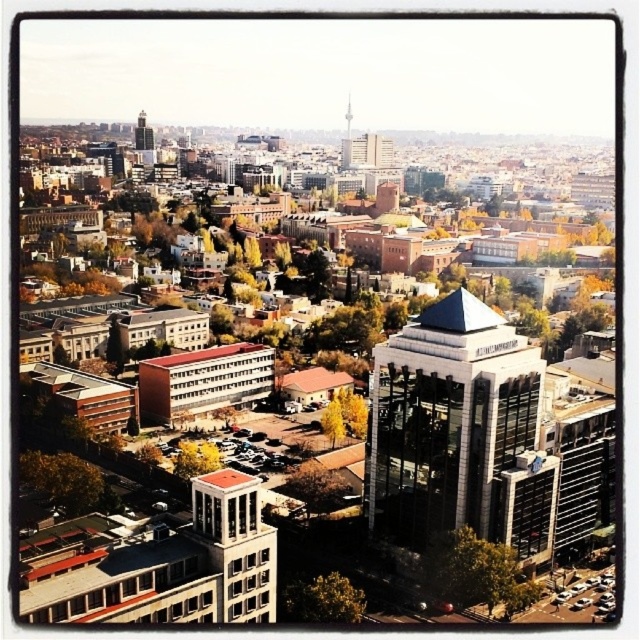
Question: Can you confirm if glassy silver tower at center is bigger than green leafy tree at center?

Choices:
 (A) no
 (B) yes

Answer: (B)

Question: Among these objects, which one is farthest from the camera?

Choices:
 (A) yellow-green leaves at center
 (B) green leafy tree at center

Answer: (A)

Question: Based on their relative distances, which object is farther from the glassy silver tower at center?

Choices:
 (A) green leafy tree at lower right
 (B) green leafy tree at lower center

Answer: (B)

Question: Does green leafy tree at lower right appear under green leafy tree at lower center?

Choices:
 (A) no
 (B) yes

Answer: (B)

Question: Does glassy silver tower at center lie behind green leafy tree at center?

Choices:
 (A) yes
 (B) no

Answer: (B)

Question: Which object is closer to the camera taking this photo?

Choices:
 (A) green leafy tree at lower left
 (B) yellow-green leaves at center
 (C) glassy silver tower at center
 (D) green leafy tree at lower right

Answer: (A)